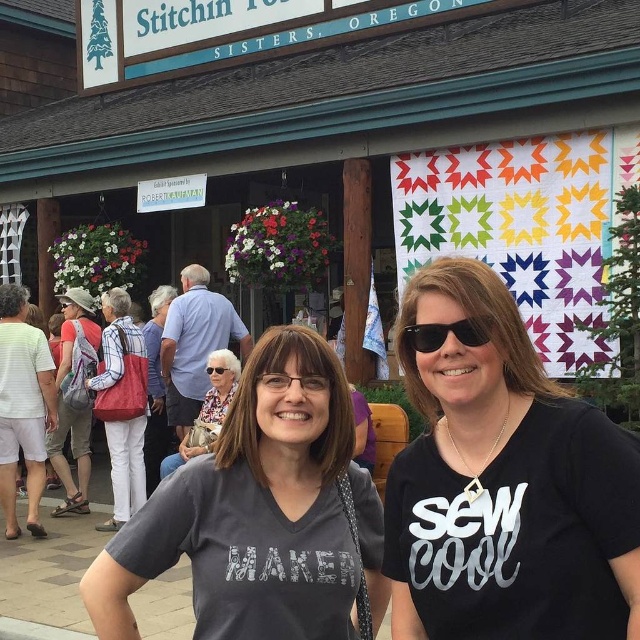
You are a photographer standing 3 meters away from the gray matte shirt at center. You need to capture a closeup shot of the matte red bag at center without moving your position. Can you do it with a standard camera lens that has a maximum zoom of 5 meters?

The distance between the gray matte shirt at center and the matte red bag at center is 5.87 meters. Since the camera lens can only zoom up to 5 meters, it cannot reach the required distance of 5.87 meters. Therefore, you cannot capture the closeup shot without moving closer.

You are a photographer trying to capture the two women in the scene. The gray matte shirt at center and the matte red bag at center are both in your viewfinder. Based on their sizes in the image, which object appears smaller?

The gray matte shirt at center appears smaller because it has a lesser height compared to the matte red bag at center.